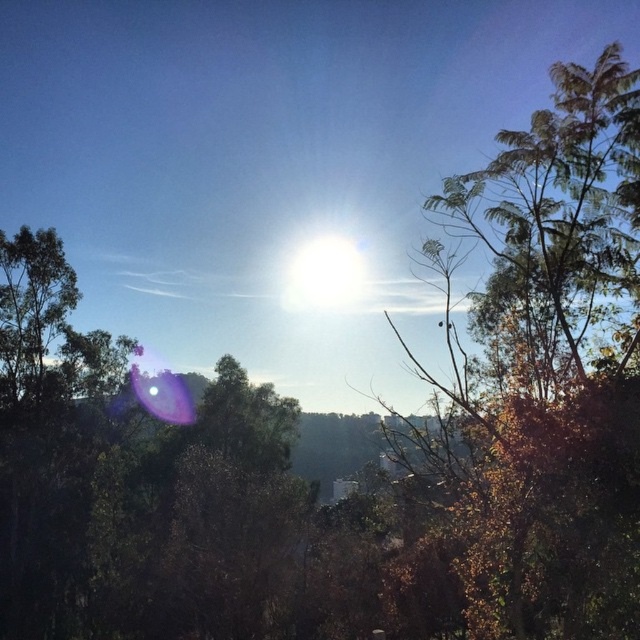
Question: Is green leafy tree at upper right bigger than bright white sun at center?

Choices:
 (A) no
 (B) yes

Answer: (B)

Question: Does green leafy tree at upper right appear on the left side of bright white sun at center?

Choices:
 (A) no
 (B) yes

Answer: (A)

Question: Which point is farther to the camera?

Choices:
 (A) green leafy tree at upper right
 (B) bright white sun at center

Answer: (B)

Question: Can you confirm if green leafy tree at upper right is thinner than bright white sun at center?

Choices:
 (A) yes
 (B) no

Answer: (B)